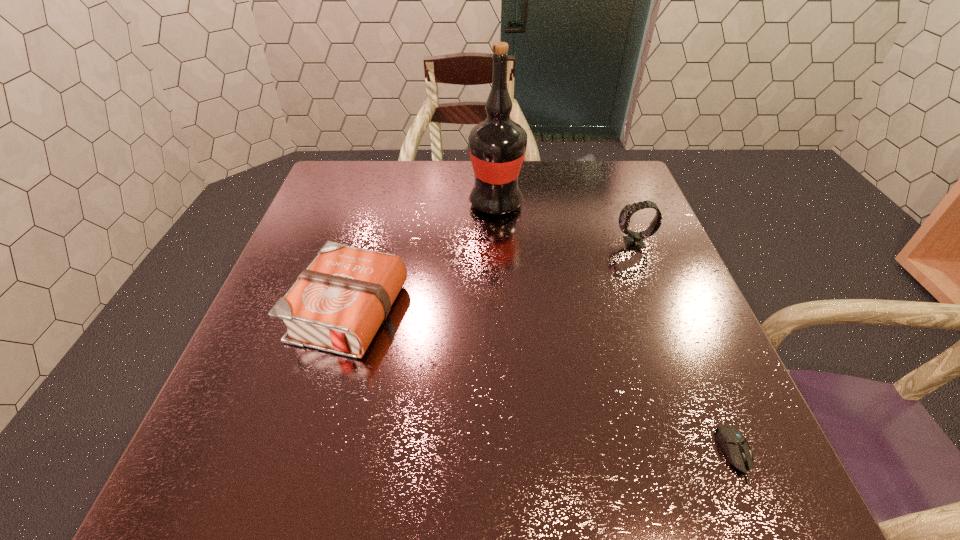
Locate an element on the screen. Image resolution: width=960 pixels, height=540 pixels. free space between the third tallest object and the farthest object is located at coordinates (422, 258).

The image size is (960, 540). I want to click on empty space that is in between the leftmost object and the watch, so click(x=492, y=278).

At what (x,y) coordinates should I click in order to perform the action: click on free spot between the third farthest object and the nearest object. Please return your answer as a coordinate pair (x, y). The width and height of the screenshot is (960, 540). Looking at the image, I should click on (542, 383).

Find the location of `empty location between the computer mouse and the second farthest object`. empty location between the computer mouse and the second farthest object is located at coordinates (684, 348).

Locate an element on the screen. The width and height of the screenshot is (960, 540). free space between the second tallest object and the computer mouse is located at coordinates (684, 348).

The height and width of the screenshot is (540, 960). I want to click on vacant area that lies between the computer mouse and the tallest object, so click(x=615, y=329).

Where is `free area in between the third nearest object and the shortest object`? The width and height of the screenshot is (960, 540). free area in between the third nearest object and the shortest object is located at coordinates (684, 348).

The image size is (960, 540). In order to click on object identified as the closest to the computer mouse in this screenshot , I will do `click(634, 239)`.

Image resolution: width=960 pixels, height=540 pixels. I want to click on the third closest object to the third nearest object, so click(337, 304).

I want to click on vacant space that satisfies the following two spatial constraints: 1. on the back side of the second object from left to right; 2. on the left side of the Bible, so click(x=380, y=204).